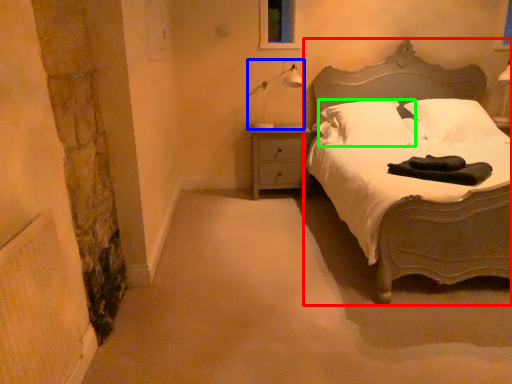
Question: Which object is the farthest from bed (highlighted by a red box)? Choose among these: lamp (highlighted by a blue box) or pillow (highlighted by a green box).

Choices:
 (A) lamp
 (B) pillow

Answer: (A)